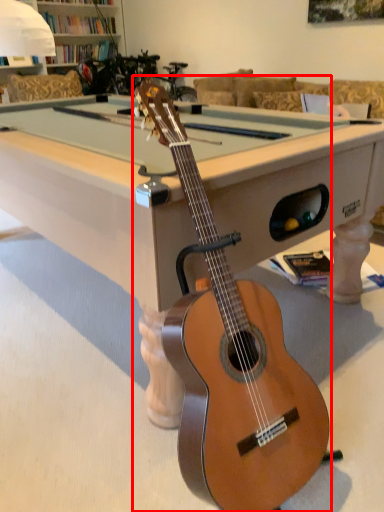
Question: From the image's perspective, where is guitar (annotated by the red box) located relative to billiard table?

Choices:
 (A) above
 (B) below

Answer: (B)